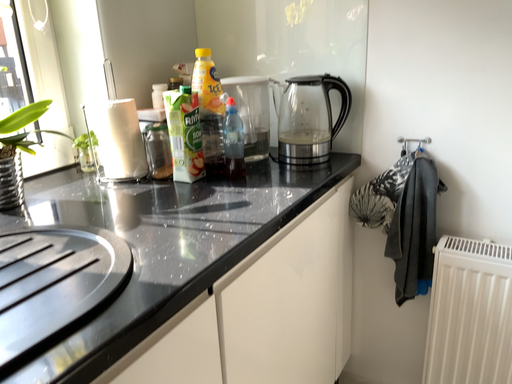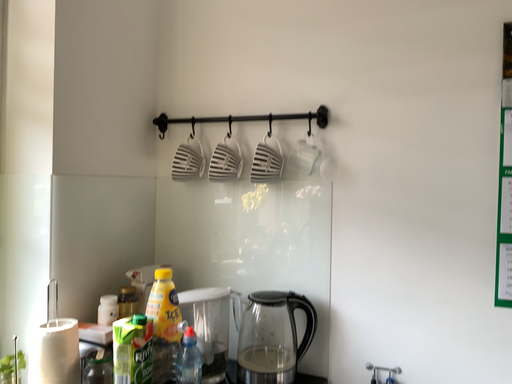
Question: Which way did the camera rotate in the video?

Choices:
 (A) rotated right
 (B) rotated left

Answer: (A)